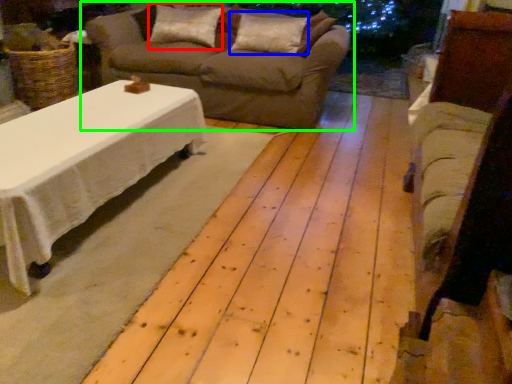
Question: Which object is the closest to the pillow (highlighted by a red box)? Choose among these: pillow (highlighted by a blue box) or studio couch (highlighted by a green box).

Choices:
 (A) pillow
 (B) studio couch

Answer: (B)